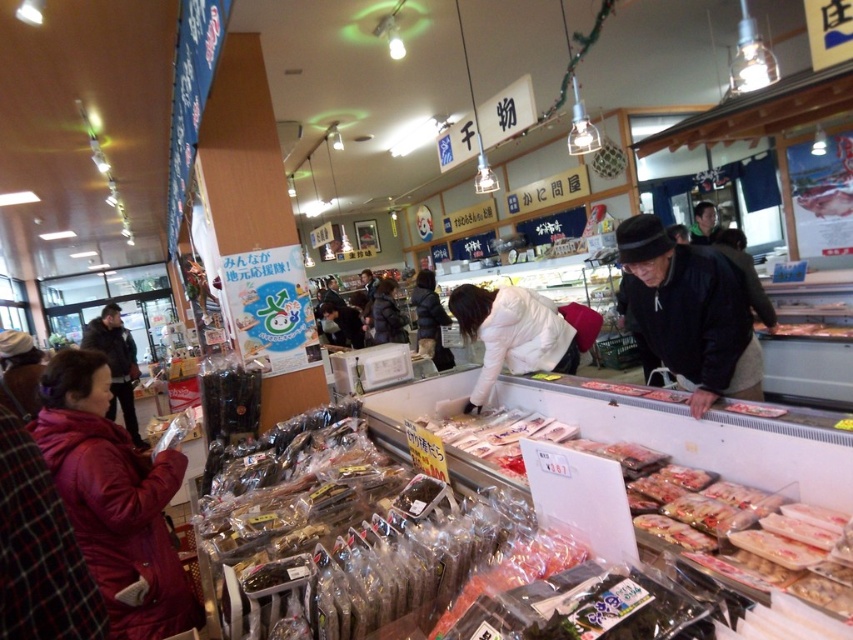
Question: Which point is closer to the camera?

Choices:
 (A) (664, 300)
 (B) (442, 358)
 (C) (531, 326)

Answer: (A)

Question: Where is translucent plastic seaweed at center located in relation to black matte jacket at center in the image?

Choices:
 (A) above
 (B) below

Answer: (B)

Question: Considering the real-world distances, which object is closest to the maroon synthetic coat at lower left?

Choices:
 (A) dark brown leather jacket at lower left
 (B) black matte jacket at center
 (C) dark blue jacket at center
 (D) white matte jacket at center

Answer: (D)

Question: Which object appears farthest from the camera in this image?

Choices:
 (A) white matte jacket at center
 (B) translucent plastic seaweed at center
 (C) dark brown leather jacket at lower left
 (D) maroon synthetic coat at lower left

Answer: (C)

Question: Is white matte jacket at center above dark brown leather jacket at lower left?

Choices:
 (A) no
 (B) yes

Answer: (B)

Question: Does maroon synthetic coat at lower left have a larger size compared to dark blue jacket at center?

Choices:
 (A) no
 (B) yes

Answer: (A)